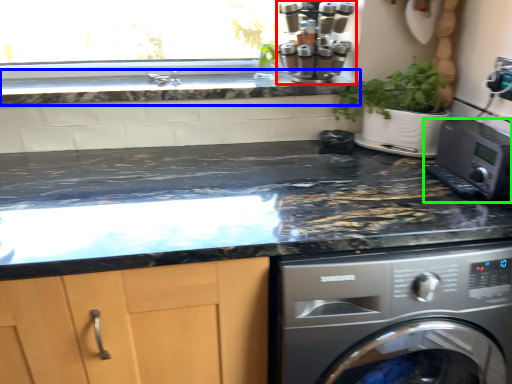
Question: Based on their relative distances, which object is farther from coffee machine (highlighted by a red box)? Choose from countertop (highlighted by a blue box) and home appliance (highlighted by a green box).

Choices:
 (A) countertop
 (B) home appliance

Answer: (B)